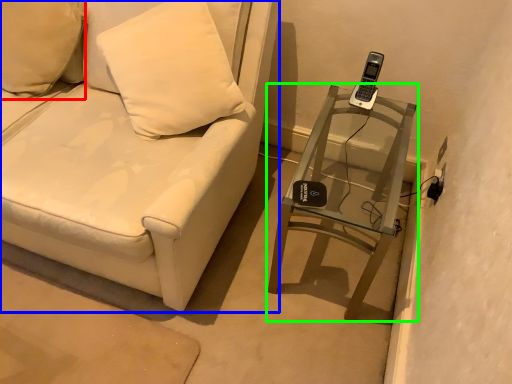
Question: Which object is positioned farthest from pillow (highlighted by a red box)? Select from furniture (highlighted by a blue box) and table (highlighted by a green box).

Choices:
 (A) furniture
 (B) table

Answer: (B)